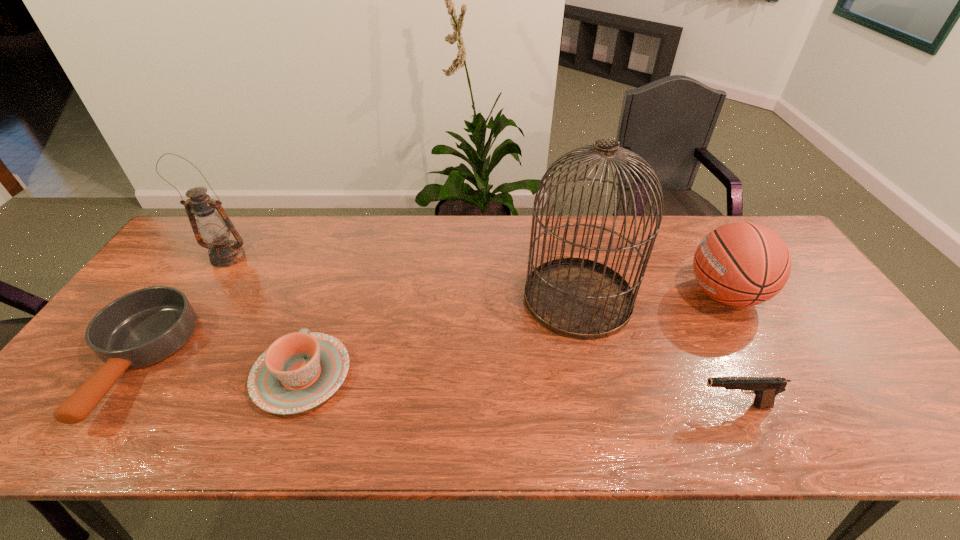
What are the coordinates of `chinaware that is at the near edge` in the screenshot? It's located at (299, 371).

Image resolution: width=960 pixels, height=540 pixels. I want to click on pan at the near edge, so click(x=139, y=329).

Identify the location of oil lamp situated at the left edge. This screenshot has width=960, height=540. (213, 226).

Where is `pan present at the left edge`? pan present at the left edge is located at coordinates (139, 329).

This screenshot has height=540, width=960. What are the coordinates of `object located in the right edge section of the desktop` in the screenshot? It's located at (741, 264).

Locate an element on the screen. This screenshot has height=540, width=960. object situated at the far left corner is located at coordinates (213, 226).

This screenshot has width=960, height=540. What are the coordinates of `object at the near left corner` in the screenshot? It's located at (139, 329).

Locate an element on the screen. This screenshot has height=540, width=960. blank area at the far edge is located at coordinates (260, 249).

The height and width of the screenshot is (540, 960). I want to click on free point at the near edge, so click(x=612, y=421).

This screenshot has width=960, height=540. Identify the location of free region at the left edge. pyautogui.click(x=177, y=274).